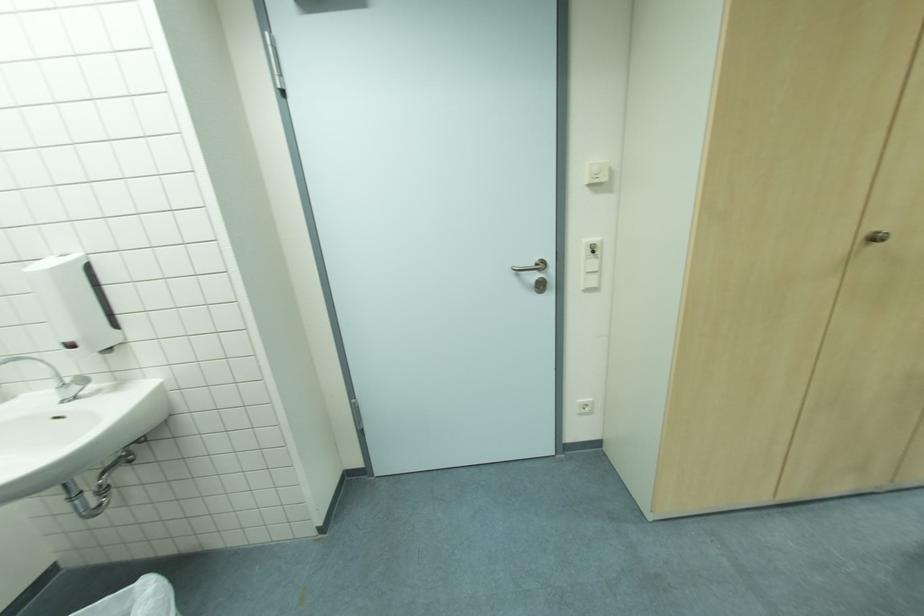
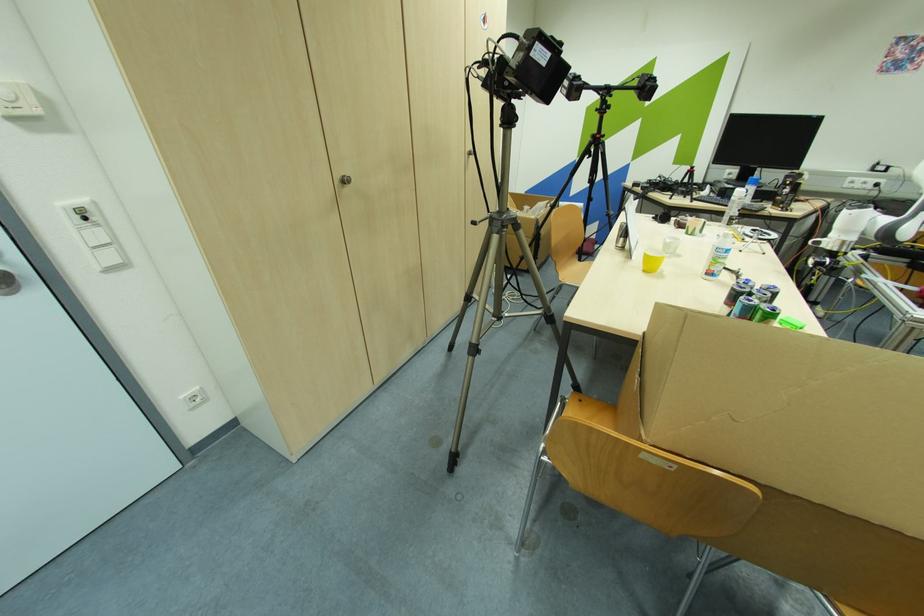
Locate, in the second image, the point that corresponds to (598,277) in the first image.

(116, 251)